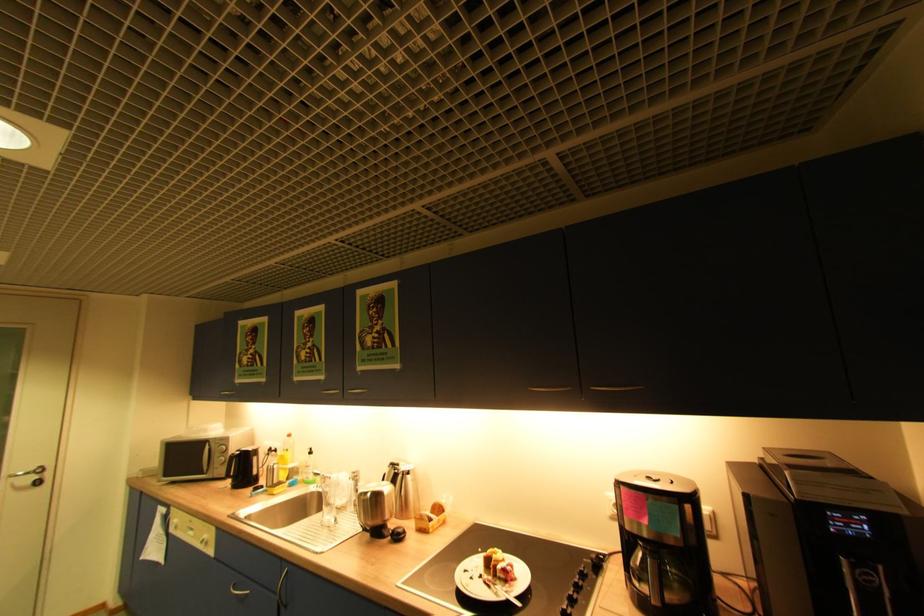
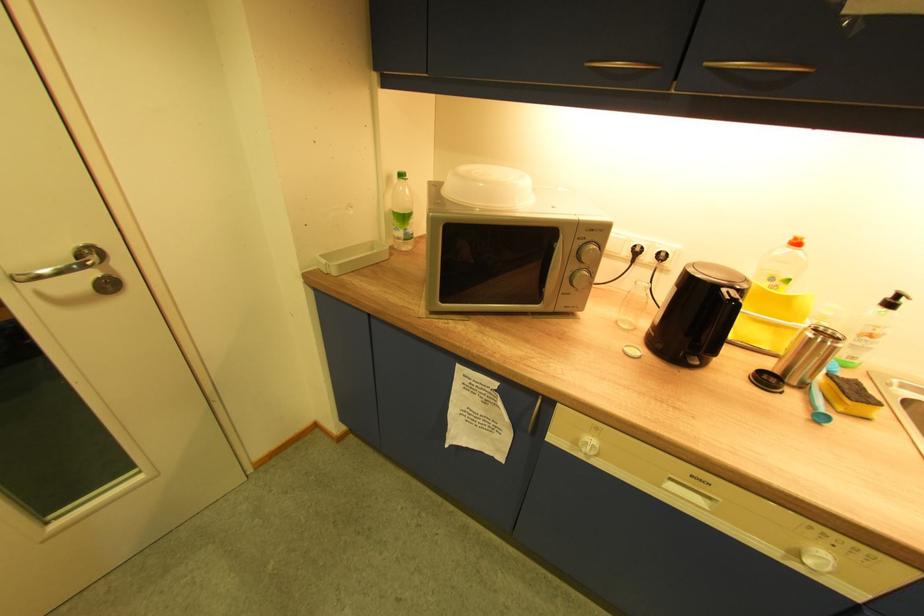
In the second image, find the point that corresponds to point 263,490 in the first image.

(772, 382)